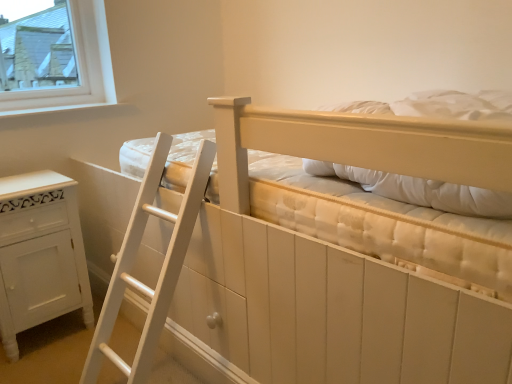
Question: Considering the relative positions of matte white bunk bed at center and white quilted pillow at upper right in the image provided, is matte white bunk bed at center to the left or to the right of white quilted pillow at upper right?

Choices:
 (A) left
 (B) right

Answer: (A)

Question: From a real-world perspective, is matte white bunk bed at center physically located above or below white quilted pillow at upper right?

Choices:
 (A) below
 (B) above

Answer: (A)

Question: Considering the real-world distances, which object is closest to the white wood at upper left?

Choices:
 (A) white quilted pillow at upper right
 (B) matte white bunk bed at center
 (C) white painted wood cabinet at lower left
 (D) white wood drawer at lower center

Answer: (C)

Question: Which object is the closest to the matte white bunk bed at center?

Choices:
 (A) white wood at upper left
 (B) white wood drawer at lower center
 (C) white quilted pillow at upper right
 (D) white painted wood cabinet at lower left

Answer: (C)